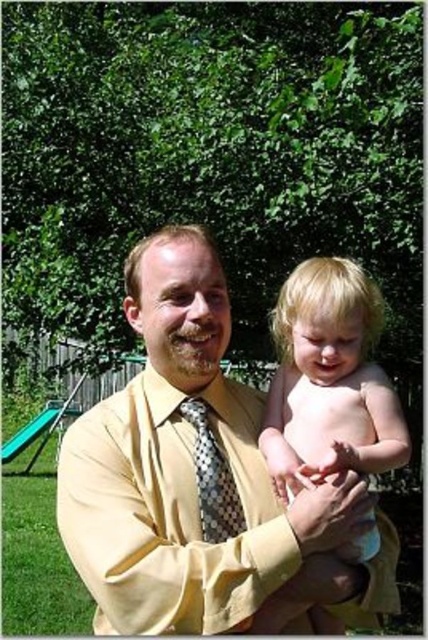
Does yellow satin shirt at center appear over blonde hair at center?

Indeed, yellow satin shirt at center is positioned over blonde hair at center.

Find the location of `yellow satin shirt at center`. yellow satin shirt at center is located at coordinates (196, 477).

Locate an element on the screen. yellow satin shirt at center is located at coordinates (196, 477).

Which is behind, point (177, 237) or point (237, 512)?

The point (177, 237) is behind.

From the picture: Between yellow satin shirt at center and polka dot silk tie at center, which one is positioned higher?

yellow satin shirt at center is above.

Who is more distant from viewer, (226,627) or (202,529)?

Point (202,529)

At what (x,y) coordinates should I click in order to perform the action: click on yellow satin shirt at center. Please return your answer as a coordinate pair (x, y). Image resolution: width=428 pixels, height=640 pixels. Looking at the image, I should click on (196, 477).

Does blonde hair at center lie in front of polka dot silk tie at center?

Yes, blonde hair at center is in front of polka dot silk tie at center.

Locate an element on the screen. blonde hair at center is located at coordinates (329, 380).

Is point (359, 394) in front of point (216, 532)?

No, it is not.

Identify the location of blonde hair at center. (329, 380).